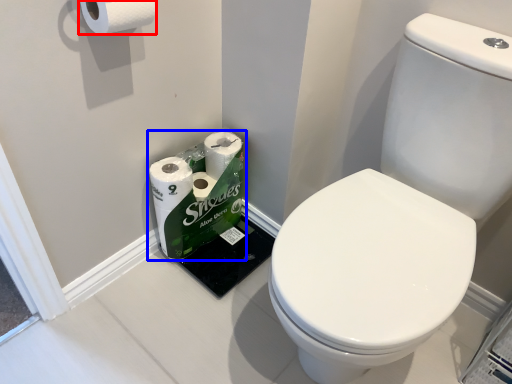
Question: Which object appears farthest to the camera in this image, toilet paper (highlighted by a red box) or toilet paper (highlighted by a blue box)?

Choices:
 (A) toilet paper
 (B) toilet paper

Answer: (B)